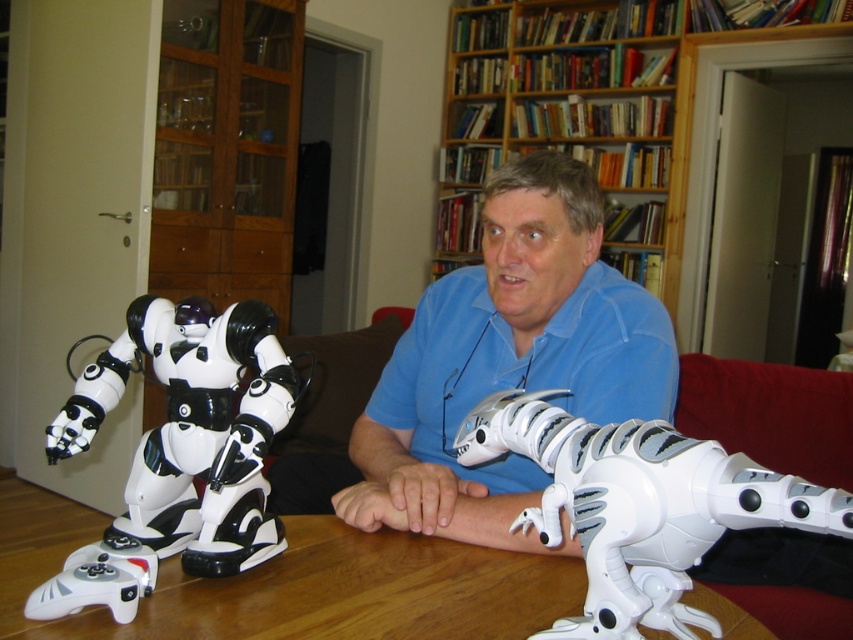
Is wooden table at lower center taller than white matte robot at left?

Incorrect, wooden table at lower center's height is not larger of white matte robot at left's.

Is wooden table at lower center above white matte robot at left?

Incorrect, wooden table at lower center is not positioned above white matte robot at left.

Between point (88, 625) and point (140, 582), which one is positioned behind?

Positioned behind is point (140, 582).

Identify the location of wooden table at lower center. (294, 584).

Is blue matte shirt at center further to the viewer compared to white matte dinosaur at lower right?

Yes, blue matte shirt at center is further from the viewer.

Is blue matte shirt at center below white matte dinosaur at lower right?

No.

Is point (508, 280) closer to camera compared to point (663, 451)?

That is False.

At what (x,y) coordinates should I click in order to perform the action: click on blue matte shirt at center. Please return your answer as a coordinate pair (x, y). This screenshot has width=853, height=640. Looking at the image, I should click on (508, 358).

Which of these two, white matte dinosaur at lower right or wooden bookshelf at upper center, stands taller?

With more height is wooden bookshelf at upper center.

The height and width of the screenshot is (640, 853). I want to click on white matte dinosaur at lower right, so click(637, 506).